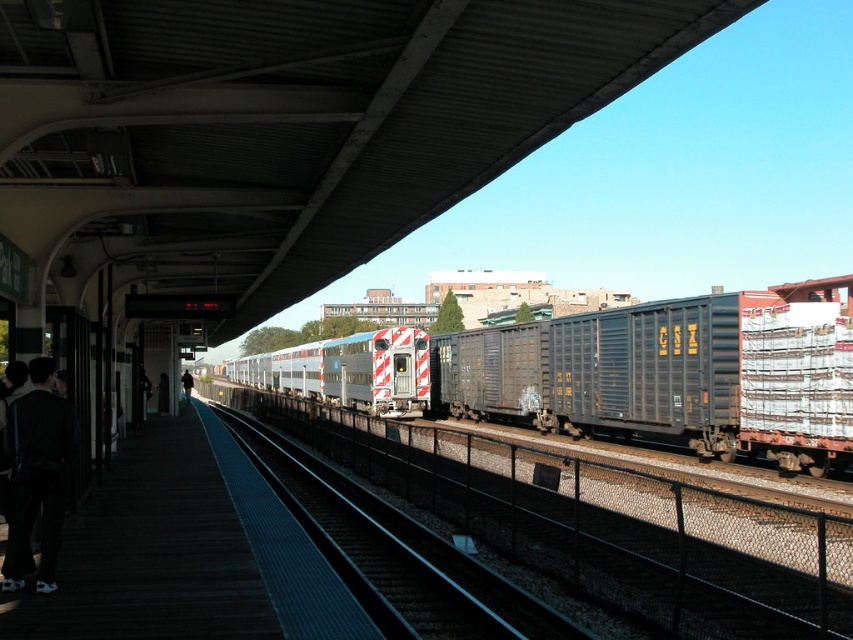
Question: Which of the following is the farthest from the observer?

Choices:
 (A) (184, 381)
 (B) (380, 348)
 (C) (531, 384)

Answer: (A)

Question: Does black metal train track at center have a larger size compared to silver/white painted metal passenger train at center?

Choices:
 (A) no
 (B) yes

Answer: (A)

Question: Which of the following is the closest to the observer?

Choices:
 (A) (183, 378)
 (B) (184, 468)
 (C) (20, 541)

Answer: (C)

Question: Does dark wood platform at lower left appear on the right side of dark gray pants at left?

Choices:
 (A) yes
 (B) no

Answer: (B)

Question: Is silver/white painted metal passenger train at center to the left of black leather jacket at lower left from the viewer's perspective?

Choices:
 (A) yes
 (B) no

Answer: (B)

Question: Which is nearer to the silver/white painted metal passenger train at center?

Choices:
 (A) black leather jacket at lower left
 (B) black metal train track at center
 (C) dark wood platform at lower left

Answer: (A)